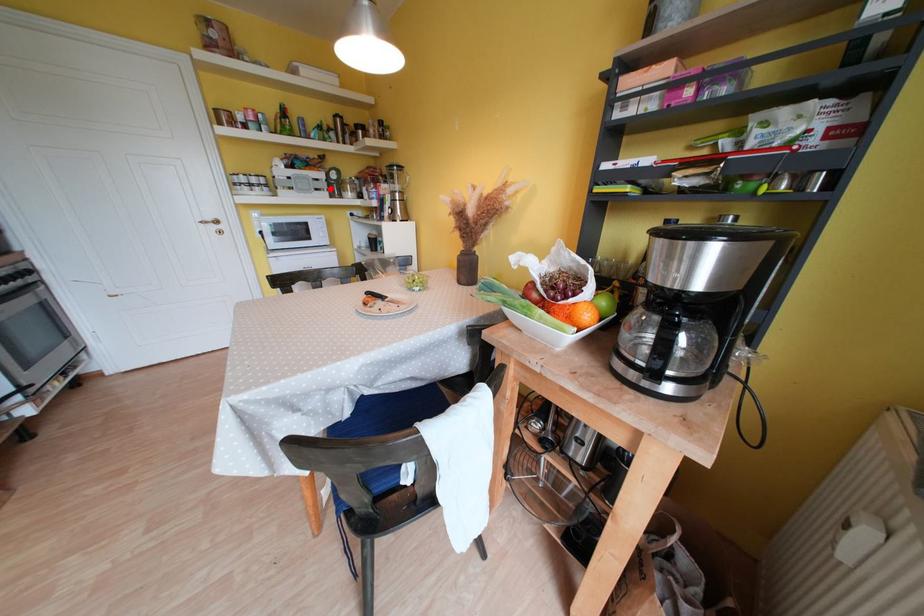
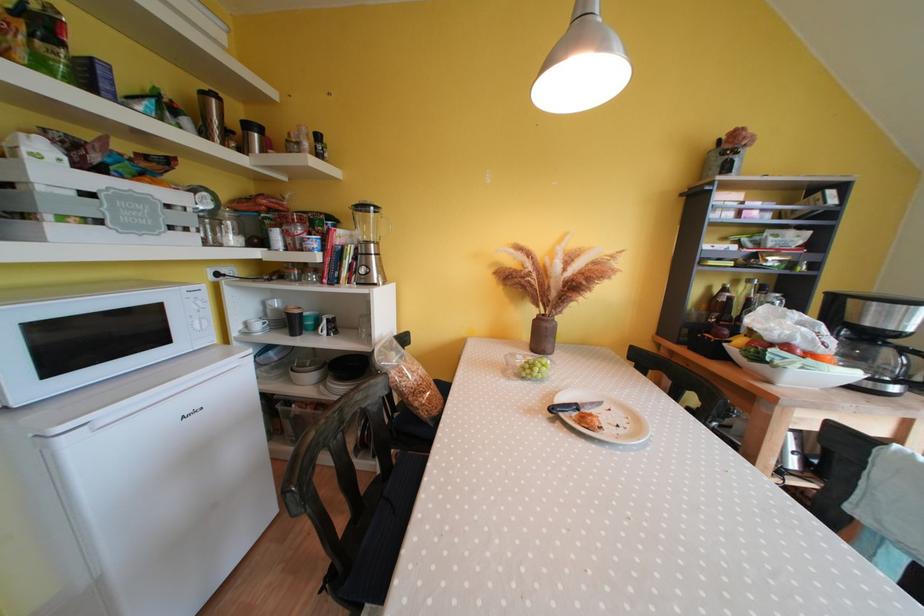
In the second image, find the point that corresponds to the highlighted location in the first image.

(196, 224)